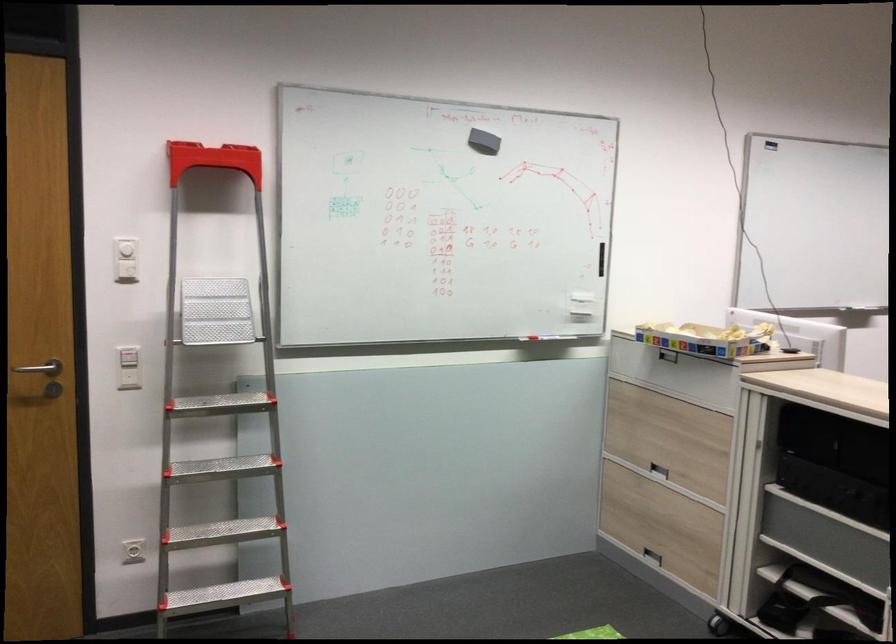
Describe the element at coordinates (814, 603) in the screenshot. Image resolution: width=896 pixels, height=644 pixels. I see `the black bag strap` at that location.